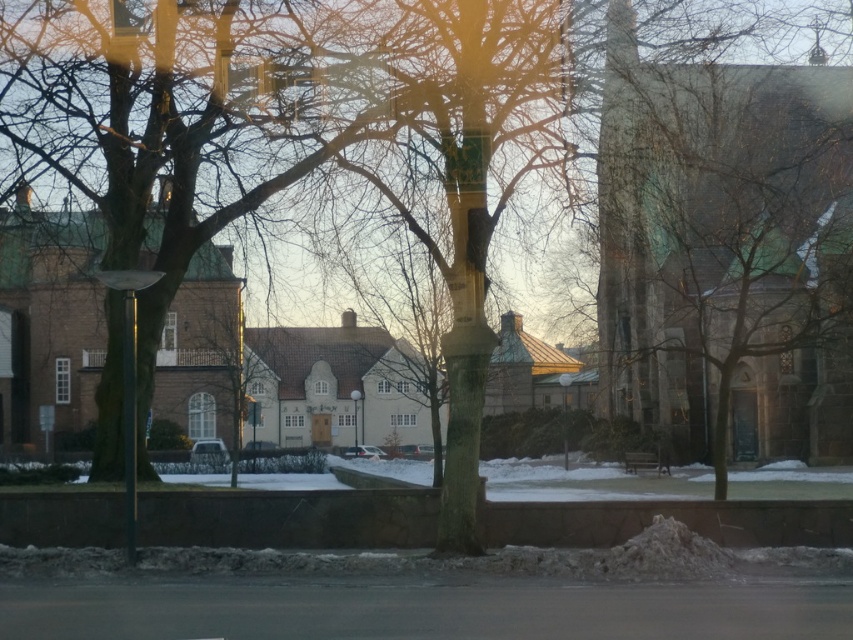
You are an architect designing a new structure that must not exceed the height of the metallic pole at center. Based on the scene, can the smooth gray stone church tower at right be used as a reference for the maximum allowed height?

The smooth gray stone church tower at right has a greater height compared to the metallic pole at center, so it cannot be used as a reference for the maximum allowed height since it exceeds the pole.

You are an architect analyzing the winter scene through the window. You need to determine which object occupies more horizontal space in the composition. Based on the brown textured tree at left and the metallic pole at center, which one has a greater width?

The brown textured tree at left has a greater width than the metallic pole at center.

Consider the image. Based on the scene described, where exactly is the smooth gray stone church tower at right located in terms of coordinates?

The smooth gray stone church tower at right is located at point coordinates of (x=718, y=237).